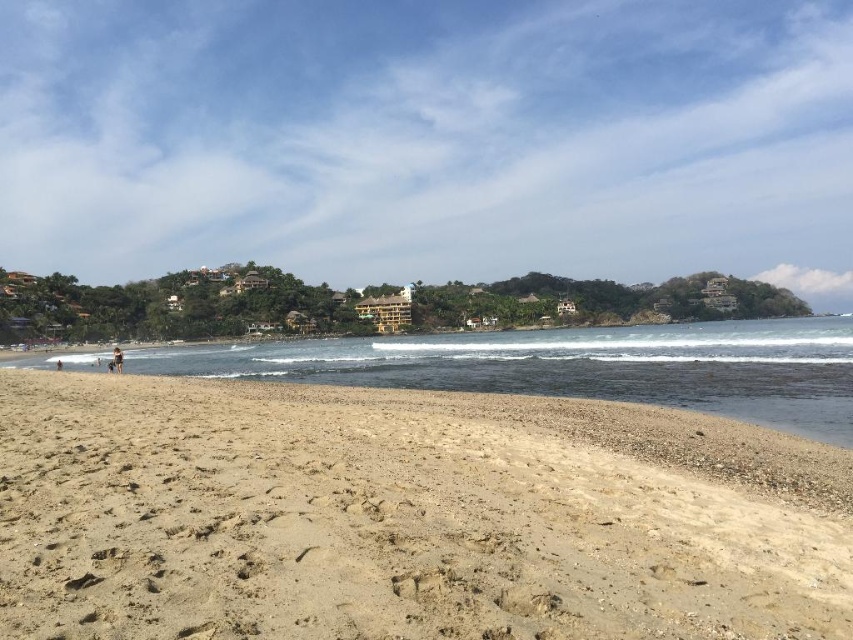
Does light brown sandy beach at lower left have a lesser width compared to tan skin person at lower left?

Indeed, light brown sandy beach at lower left has a lesser width compared to tan skin person at lower left.

Who is shorter, light brown sandy beach at lower left or tan skin person at lower left?

light brown sandy beach at lower left is shorter.

Image resolution: width=853 pixels, height=640 pixels. What are the coordinates of `light brown sandy beach at lower left` in the screenshot? It's located at (405, 516).

Which is behind, point (379, 556) or point (746, 332)?

The point (746, 332) is more distant.

Is point (225, 515) closer to camera compared to point (267, 358)?

That is True.

I want to click on light brown sandy beach at lower left, so click(x=405, y=516).

Is point (583, 364) more distant than point (113, 360)?

Yes.

Between point (795, 346) and point (119, 365), which one is positioned behind?

Positioned behind is point (795, 346).

The width and height of the screenshot is (853, 640). What do you see at coordinates (578, 365) in the screenshot? I see `clear water at center` at bounding box center [578, 365].

What are the coordinates of `clear water at center` in the screenshot? It's located at (578, 365).